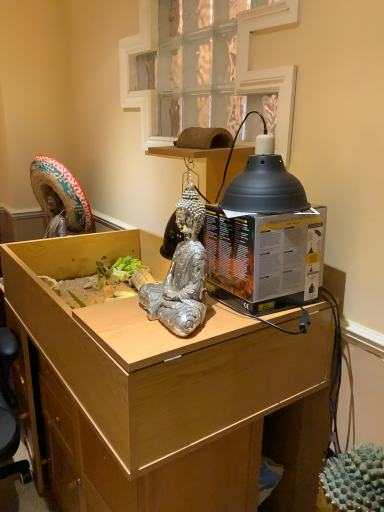
Question: Can you confirm if clear glass window at upper center is bigger than black cardboard box at right?

Choices:
 (A) no
 (B) yes

Answer: (B)

Question: Is clear glass window at upper center taller than black cardboard box at right?

Choices:
 (A) yes
 (B) no

Answer: (A)

Question: From the image's perspective, does clear glass window at upper center appear higher than black cardboard box at right?

Choices:
 (A) no
 (B) yes

Answer: (B)

Question: Would you say black cardboard box at right is part of clear glass window at upper center's contents?

Choices:
 (A) yes
 (B) no

Answer: (B)

Question: Is clear glass window at upper center shorter than black cardboard box at right?

Choices:
 (A) no
 (B) yes

Answer: (A)

Question: From the image's perspective, is clear glass window at upper center under black cardboard box at right?

Choices:
 (A) yes
 (B) no

Answer: (B)

Question: From the image's perspective, is black cardboard box at right under light wood desk at center?

Choices:
 (A) no
 (B) yes

Answer: (A)

Question: From a real-world perspective, is black cardboard box at right over light wood desk at center?

Choices:
 (A) yes
 (B) no

Answer: (A)

Question: Can we say black cardboard box at right lies outside light wood desk at center?

Choices:
 (A) no
 (B) yes

Answer: (B)

Question: Could you tell me if black cardboard box at right is turned towards light wood desk at center?

Choices:
 (A) no
 (B) yes

Answer: (A)

Question: Does black cardboard box at right have a smaller size compared to light wood desk at center?

Choices:
 (A) yes
 (B) no

Answer: (A)

Question: From a real-world perspective, is black cardboard box at right located beneath light wood desk at center?

Choices:
 (A) no
 (B) yes

Answer: (A)

Question: Could black cardboard box at right be considered to be inside black matte lampshade at upper right?

Choices:
 (A) yes
 (B) no

Answer: (B)